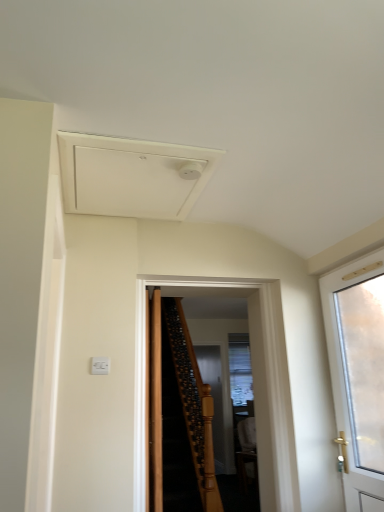
Question: Is white matte exhaust hood at upper center shorter than brown wooden door at center, which is counted as the 2th door, starting from the left?

Choices:
 (A) yes
 (B) no

Answer: (A)

Question: From the image's perspective, is white matte exhaust hood at upper center on brown wooden door at center, which is counted as the 2th door, starting from the left?

Choices:
 (A) no
 (B) yes

Answer: (B)

Question: Considering the relative positions of white matte exhaust hood at upper center and brown wooden door at center, which is the second door from right to left, in the image provided, is white matte exhaust hood at upper center to the left of brown wooden door at center, which is the second door from right to left, from the viewer's perspective?

Choices:
 (A) yes
 (B) no

Answer: (A)

Question: Is white matte exhaust hood at upper center bigger than brown wooden door at center, which is the second door from right to left?

Choices:
 (A) no
 (B) yes

Answer: (A)

Question: Is white matte exhaust hood at upper center to the right of brown wooden door at center, which is counted as the 2th door, starting from the left, from the viewer's perspective?

Choices:
 (A) yes
 (B) no

Answer: (B)

Question: From a real-world perspective, is white frosted glass door at right, which appears as the 1th door when viewed from the right, physically located above or below clear glass screen door at center?

Choices:
 (A) below
 (B) above

Answer: (B)

Question: Looking at the image, does white frosted glass door at right, which ranks as the third door in left-to-right order, seem bigger or smaller compared to clear glass screen door at center?

Choices:
 (A) small
 (B) big

Answer: (B)

Question: Is white frosted glass door at right, which appears as the 1th door when viewed from the right, taller or shorter than clear glass screen door at center?

Choices:
 (A) short
 (B) tall

Answer: (A)

Question: Visually, is white frosted glass door at right, which ranks as the third door in left-to-right order, positioned to the left or to the right of clear glass screen door at center?

Choices:
 (A) right
 (B) left

Answer: (A)

Question: From the image's perspective, relative to brown wooden door at center, the first door when ordered from left to right, is white matte exhaust hood at upper center above or below?

Choices:
 (A) below
 (B) above

Answer: (B)

Question: From a real-world perspective, is white matte exhaust hood at upper center above or below brown wooden door at center, the first door when ordered from left to right?

Choices:
 (A) below
 (B) above

Answer: (B)

Question: Based on their sizes in the image, would you say white matte exhaust hood at upper center is bigger or smaller than brown wooden door at center, arranged as the third door when viewed from the right?

Choices:
 (A) big
 (B) small

Answer: (B)

Question: From their relative heights in the image, would you say white matte exhaust hood at upper center is taller or shorter than brown wooden door at center, arranged as the third door when viewed from the right?

Choices:
 (A) short
 (B) tall

Answer: (A)

Question: Is white frosted glass door at right, which appears as the 1th door when viewed from the right, spatially inside brown wooden door at center, which is counted as the 2th door, starting from the left, or outside of it?

Choices:
 (A) inside
 (B) outside

Answer: (B)

Question: Is white frosted glass door at right, which ranks as the third door in left-to-right order, wider or thinner than brown wooden door at center, which is the second door from right to left?

Choices:
 (A) thin
 (B) wide

Answer: (B)